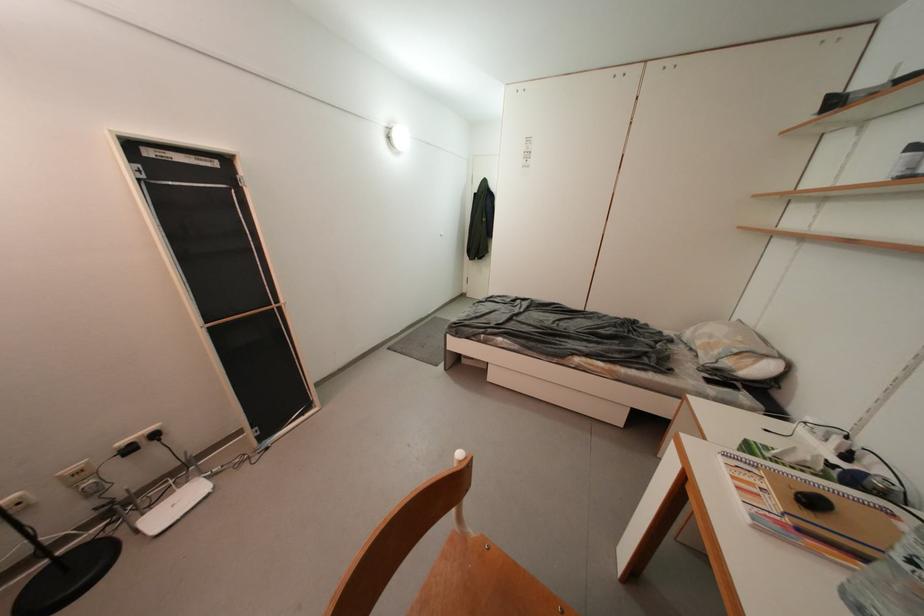
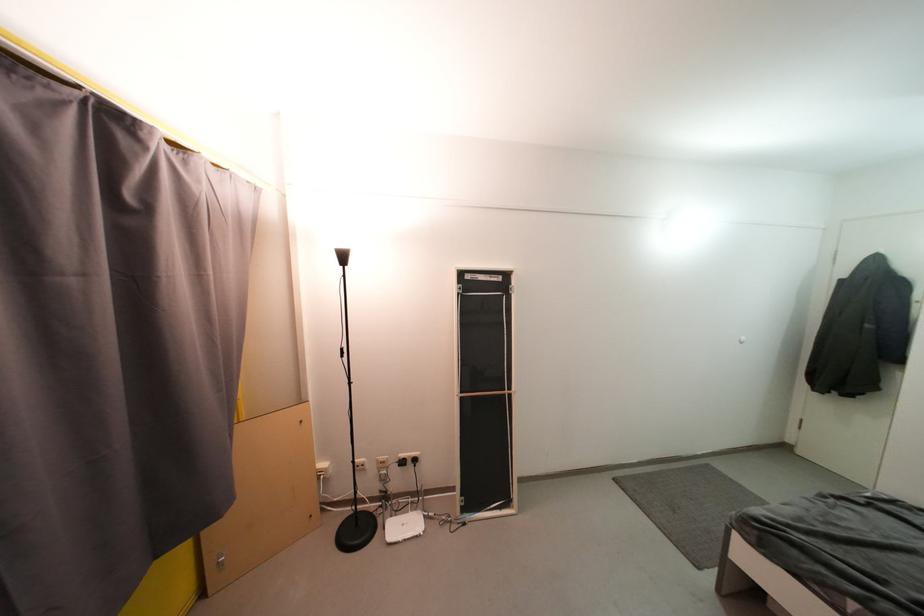
The point at (159, 509) is marked in the first image. Where is the corresponding point in the second image?

(405, 515)